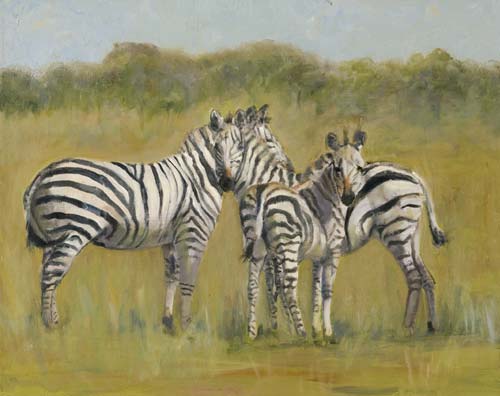
Find the location of a particular element. This screenshot has width=500, height=396. oil painting is located at coordinates (232, 247).